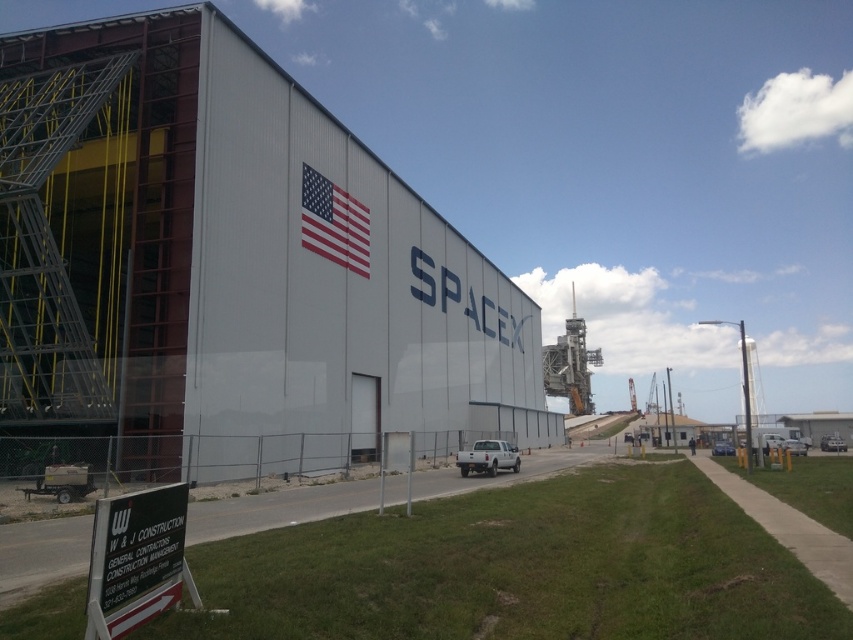
Question: Can you confirm if gray metallic building at center is bigger than silver metallic sedan at lower right?

Choices:
 (A) no
 (B) yes

Answer: (B)

Question: Does gray metallic building at center appear on the left side of silver metallic sedan at lower right?

Choices:
 (A) no
 (B) yes

Answer: (B)

Question: Which object is the closest to the red fabric american flag at upper center?

Choices:
 (A) metallic blue sedan at center
 (B) white glossy car at lower right
 (C) white plastic sign at lower left
 (D) silver metallic sedan at lower right

Answer: (C)

Question: Which point is farther to the camera?

Choices:
 (A) white plastic sign at lower left
 (B) red fabric american flag at upper center
 (C) white matte truck at center

Answer: (B)

Question: Can you confirm if white matte truck at center is bigger than silver metallic sedan at lower right?

Choices:
 (A) yes
 (B) no

Answer: (A)

Question: Which object appears farthest from the camera in this image?

Choices:
 (A) white matte truck at center
 (B) gray metallic building at center
 (C) white glossy car at lower right
 (D) metallic blue sedan at center

Answer: (D)